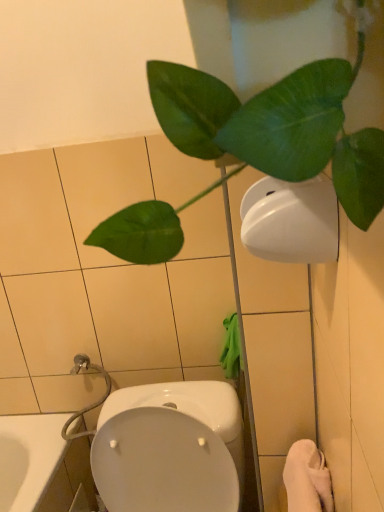
Question: Is white soft towel at lower right shorter than white glossy toilet at lower center?

Choices:
 (A) yes
 (B) no

Answer: (A)

Question: Is there a large distance between white soft towel at lower right and white glossy toilet at lower center?

Choices:
 (A) no
 (B) yes

Answer: (A)

Question: Would you say white glossy toilet at lower center is part of white soft towel at lower right's contents?

Choices:
 (A) yes
 (B) no

Answer: (B)

Question: Could you tell me if white soft towel at lower right is facing white glossy toilet at lower center?

Choices:
 (A) yes
 (B) no

Answer: (B)

Question: Is white soft towel at lower right behind white glossy toilet at lower center?

Choices:
 (A) no
 (B) yes

Answer: (A)

Question: Considering the positions of point (256, 161) and point (309, 454), is point (256, 161) closer or farther from the camera than point (309, 454)?

Choices:
 (A) closer
 (B) farther

Answer: (A)

Question: Considering their positions, is green matte leafy plant at upper right located in front of or behind white soft towel at lower right?

Choices:
 (A) front
 (B) behind

Answer: (A)

Question: From a real-world perspective, is green matte leafy plant at upper right physically located above or below white soft towel at lower right?

Choices:
 (A) above
 (B) below

Answer: (A)

Question: Is green matte leafy plant at upper right bigger or smaller than white soft towel at lower right?

Choices:
 (A) small
 (B) big

Answer: (B)

Question: From their relative heights in the image, would you say white soft towel at lower right is taller or shorter than white matte toilet paper at upper right?

Choices:
 (A) tall
 (B) short

Answer: (A)

Question: Visually, is white soft towel at lower right positioned to the left or to the right of white matte toilet paper at upper right?

Choices:
 (A) right
 (B) left

Answer: (A)

Question: Considering the positions of white soft towel at lower right and white matte toilet paper at upper right in the image, is white soft towel at lower right wider or thinner than white matte toilet paper at upper right?

Choices:
 (A) thin
 (B) wide

Answer: (B)

Question: From a real-world perspective, is white soft towel at lower right physically located above or below white matte toilet paper at upper right?

Choices:
 (A) above
 (B) below

Answer: (B)

Question: Which is correct: green matte leafy plant at upper right is inside white matte toilet paper at upper right, or outside of it?

Choices:
 (A) inside
 (B) outside

Answer: (B)

Question: From the image's perspective, relative to white matte toilet paper at upper right, is green matte leafy plant at upper right above or below?

Choices:
 (A) below
 (B) above

Answer: (B)